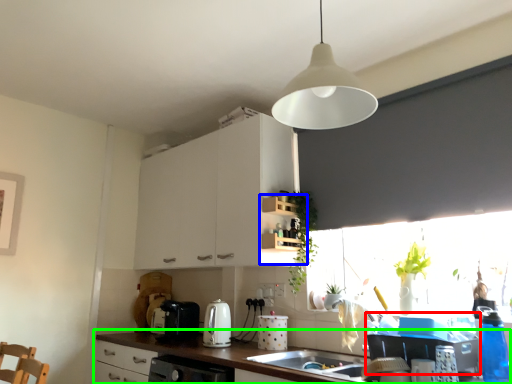
Question: Considering the real-world distances, which object is closest to appliance (highlighted by a red box)? shelf (highlighted by a blue box) or countertop (highlighted by a green box).

Choices:
 (A) shelf
 (B) countertop

Answer: (B)